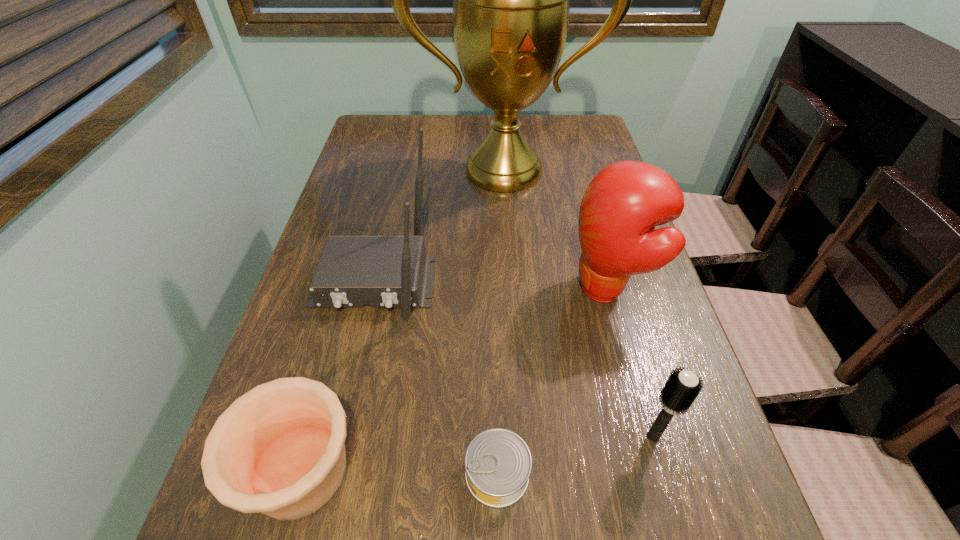
I want to click on vacant region between the pottery and the boxing glove, so click(454, 380).

Find the location of `vacant region between the pottery and the router`. vacant region between the pottery and the router is located at coordinates (337, 376).

Identify the location of unoccupied position between the second shortest object and the boxing glove. (454, 380).

Locate an element on the screen. This screenshot has height=540, width=960. vacant space that's between the router and the farthest object is located at coordinates (439, 226).

Identify the location of free space between the boxing glove and the fourth tallest object. The image size is (960, 540). (630, 363).

The width and height of the screenshot is (960, 540). What are the coordinates of `free space between the boxing glove and the pottery` in the screenshot? It's located at [454, 380].

Image resolution: width=960 pixels, height=540 pixels. What are the coordinates of `empty space that is in between the trophy cup and the boxing glove` in the screenshot? It's located at (556, 230).

Select which object is the fourth closest to the second shortest object. Please provide its 2D coordinates. Your answer should be formatted as a tuple, i.e. [(x, y)], where the tuple contains the x and y coordinates of a point satisfying the conditions above.

[(681, 389)]

Image resolution: width=960 pixels, height=540 pixels. In order to click on object that is the closest to the pottery in this screenshot , I will do coord(498,463).

You are a GUI agent. You are given a task and a screenshot of the screen. Output one action in this format:
    pyautogui.click(x=<x>, y=<y>)
    Task: Click on the vacant point that satisfies the following two spatial constraints: 1. on the front side of the second shortest object; 2. on the right side of the shortest object
    This screenshot has height=540, width=960.
    Given the screenshot: What is the action you would take?
    pyautogui.click(x=300, y=474)